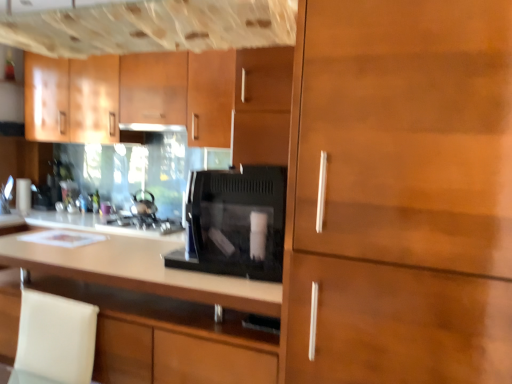
Question: Do you think matte black exhaust hood at upper center is within matte wood cabinets at upper left, which appears as the first cabinetry when viewed from the back, or outside of it?

Choices:
 (A) outside
 (B) inside

Answer: (B)

Question: Considering the positions of point (177, 129) and point (96, 62), is point (177, 129) closer or farther from the camera than point (96, 62)?

Choices:
 (A) closer
 (B) farther

Answer: (A)

Question: Estimate the real-world distances between objects in this image. Which object is closer to the matte wood cabinet at center, the 2th cabinetry positioned from the front?

Choices:
 (A) black matte microwave at center
 (B) matte black exhaust hood at upper center
 (C) white leather swivel chair at lower left
 (D) black matte microwave at center
 (E) wooden cabinet at right, placed as the 3th cabinetry when sorted from back to front

Answer: (C)

Question: Considering the real-world distances, which object is closest to the white leather swivel chair at lower left?

Choices:
 (A) matte wood cabinet at center, the second cabinetry in the back-to-front sequence
 (B) black matte microwave at center
 (C) matte wood cabinets at upper left, which is the third cabinetry in front-to-back order
 (D) shiny metallic kettle at center
 (E) matte black exhaust hood at upper center

Answer: (A)